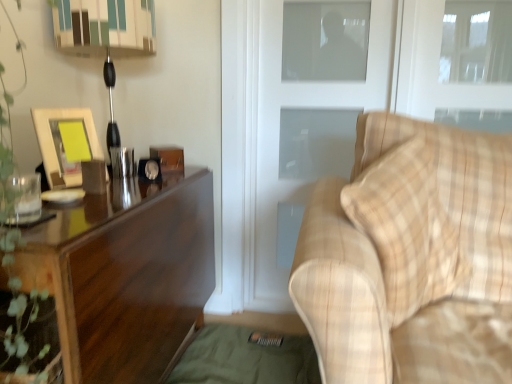
Question: Is plaid fabric couch at right thinner than transparent glass window at upper right?

Choices:
 (A) no
 (B) yes

Answer: (A)

Question: Is the depth of plaid fabric couch at right less than that of transparent glass window at upper right?

Choices:
 (A) no
 (B) yes

Answer: (B)

Question: Does plaid fabric couch at right appear on the left side of transparent glass window at upper right?

Choices:
 (A) yes
 (B) no

Answer: (A)

Question: Would you say transparent glass window at upper right is part of plaid fabric couch at right's contents?

Choices:
 (A) no
 (B) yes

Answer: (A)

Question: From a real-world perspective, is plaid fabric couch at right on transparent glass window at upper right?

Choices:
 (A) no
 (B) yes

Answer: (A)

Question: From a real-world perspective, is dark wood desk at left above or below matte wooden picture frame at left?

Choices:
 (A) below
 (B) above

Answer: (A)

Question: From the image's perspective, is dark wood desk at left above or below matte wooden picture frame at left?

Choices:
 (A) below
 (B) above

Answer: (A)

Question: In terms of size, does dark wood desk at left appear bigger or smaller than matte wooden picture frame at left?

Choices:
 (A) small
 (B) big

Answer: (B)

Question: Based on their positions, is dark wood desk at left located to the left or right of matte wooden picture frame at left?

Choices:
 (A) right
 (B) left

Answer: (A)

Question: Does point (327, 240) appear closer or farther from the camera than point (195, 198)?

Choices:
 (A) farther
 (B) closer

Answer: (B)

Question: Is plaid fabric couch at right bigger or smaller than dark wood desk at left?

Choices:
 (A) big
 (B) small

Answer: (B)

Question: From the image's perspective, is plaid fabric couch at right located above or below dark wood desk at left?

Choices:
 (A) below
 (B) above

Answer: (B)

Question: From a real-world perspective, is plaid fabric couch at right above or below dark wood desk at left?

Choices:
 (A) below
 (B) above

Answer: (B)

Question: Would you say white frosted glass screen door at center is inside or outside matte wooden picture frame at left?

Choices:
 (A) outside
 (B) inside

Answer: (A)

Question: Would you say white frosted glass screen door at center is to the left or to the right of matte wooden picture frame at left in the picture?

Choices:
 (A) right
 (B) left

Answer: (A)